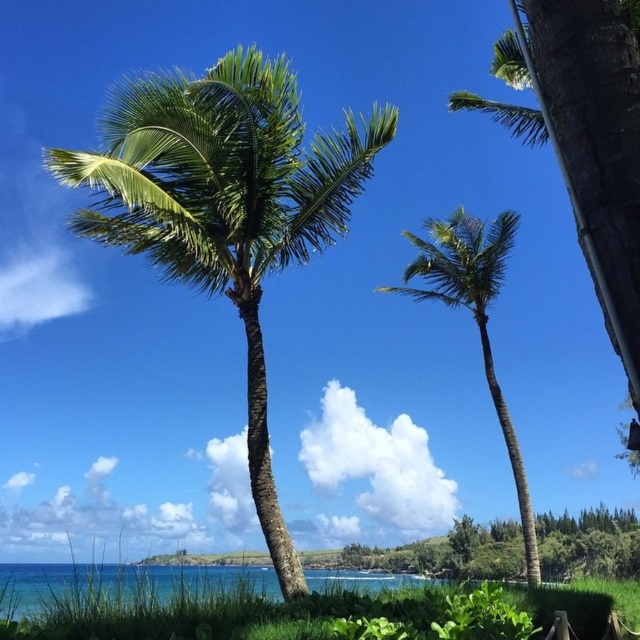
You are standing at the center of the beach scene. There is a green leafy coconut tree at center. Which direction should you walk to reach the palm tree on the left?

The green leafy coconut tree at center is located at point (x=225, y=205), so you should walk to the left to reach the palm tree on the left.

You are standing at the point marked by the coordinates point (x=120, y=582). Looking around, you see the two palm trees mentioned in the scene. Which direction should you walk to reach the taller palm tree?

The palm tree on the left is slightly taller than the one on the right. Since you are at point (x=120, y=582) which is the clear blue water at lower left, you should walk towards the right to reach the taller palm tree on the left.

In the scene shown: You are a photographer planning to capture the entire scene of the clear blue water at lower left and the green leafy palm tree at center in one shot. Based on the scene description, which object would occupy more of the frame?

The clear blue water at lower left occupies more of the frame since it is larger in size than the green leafy palm tree at center according to the description.